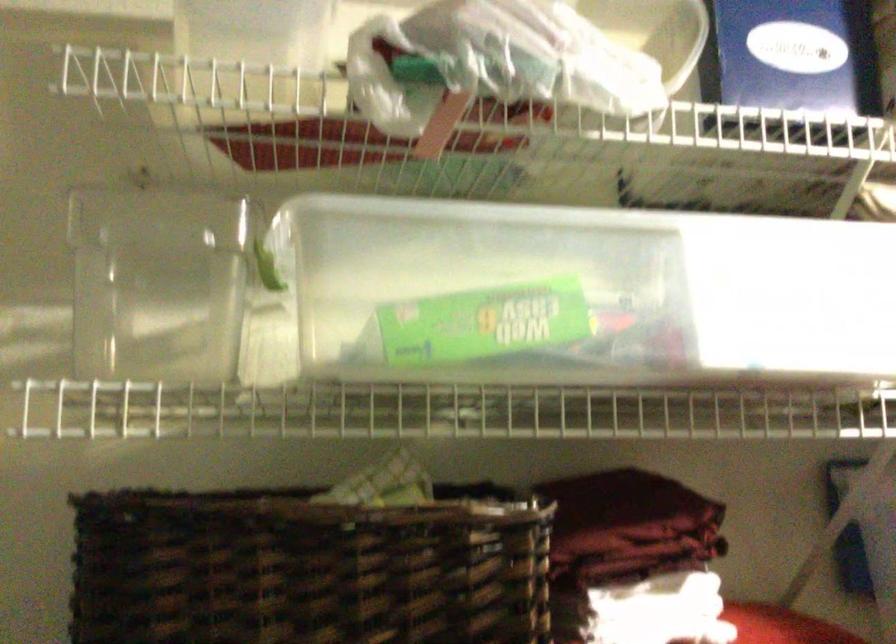
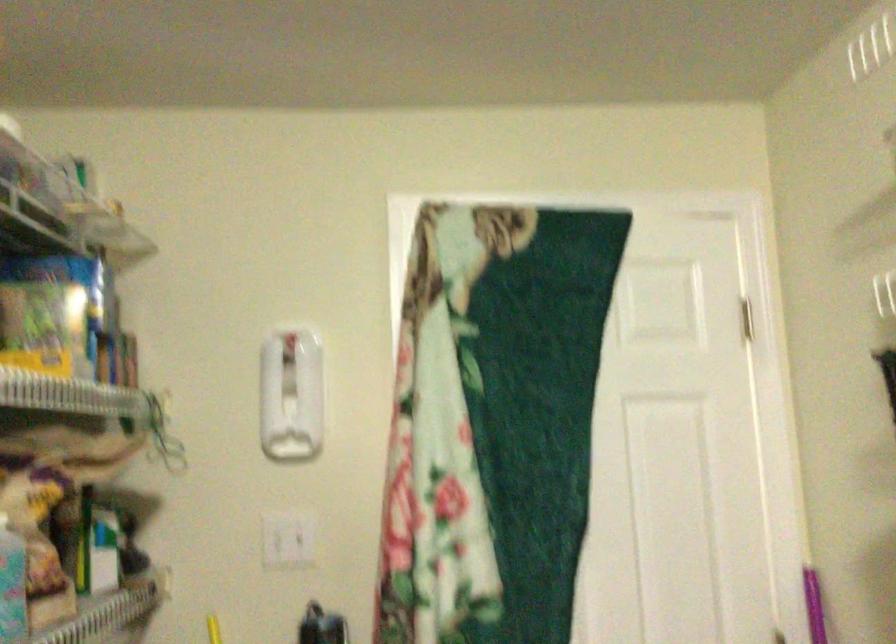
Question: Based on the continuous images, in which direction is the camera rotating? Reply with the corresponding letter.

Choices:
 (A) Left
 (B) Right
 (C) Up
 (D) Down

Answer: (A)